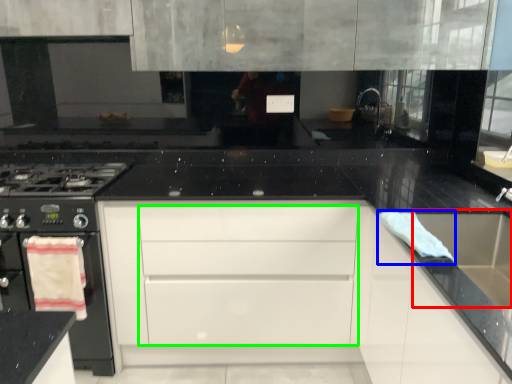
Question: Which object is the farthest from sink (highlighted by a red box)? Choose among these: material (highlighted by a blue box) or drawer (highlighted by a green box).

Choices:
 (A) material
 (B) drawer

Answer: (B)